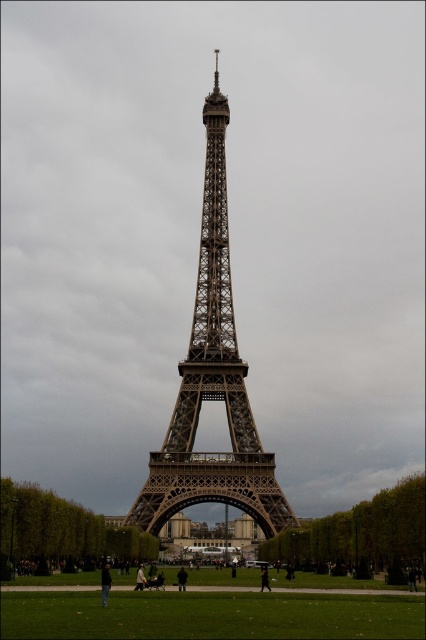
Question: Which point is farther to the camera?

Choices:
 (A) black fabric person at lower center
 (B) brown metal eiffel tower at center
 (C) green grass at lower center

Answer: (A)

Question: Which object is farther from the camera taking this photo?

Choices:
 (A) brown metal eiffel tower at center
 (B) green grass at lower center

Answer: (A)

Question: Observing the image, what is the correct spatial positioning of black fabric person at lower center in reference to dark gray fabric jacket at lower center?

Choices:
 (A) left
 (B) right

Answer: (A)

Question: Which point is farther to the camera?

Choices:
 (A) (104, 580)
 (B) (264, 573)

Answer: (B)

Question: Does green grass at lower center lie behind dark gray fabric jacket at lower center?

Choices:
 (A) no
 (B) yes

Answer: (A)

Question: Is brown metal eiffel tower at center to the right of black fabric person at lower center from the viewer's perspective?

Choices:
 (A) yes
 (B) no

Answer: (A)